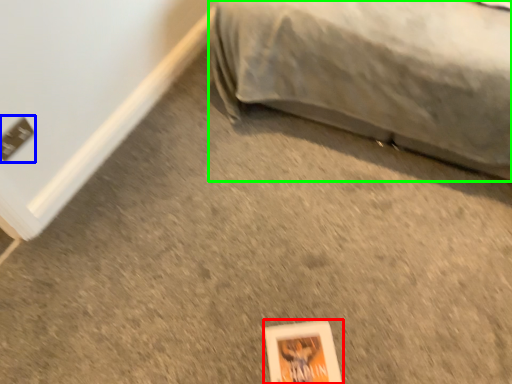
Question: Which object is the farthest from paperback book (highlighted by a red box)? Choose among these: electric outlet (highlighted by a blue box) or furniture (highlighted by a green box).

Choices:
 (A) electric outlet
 (B) furniture

Answer: (A)